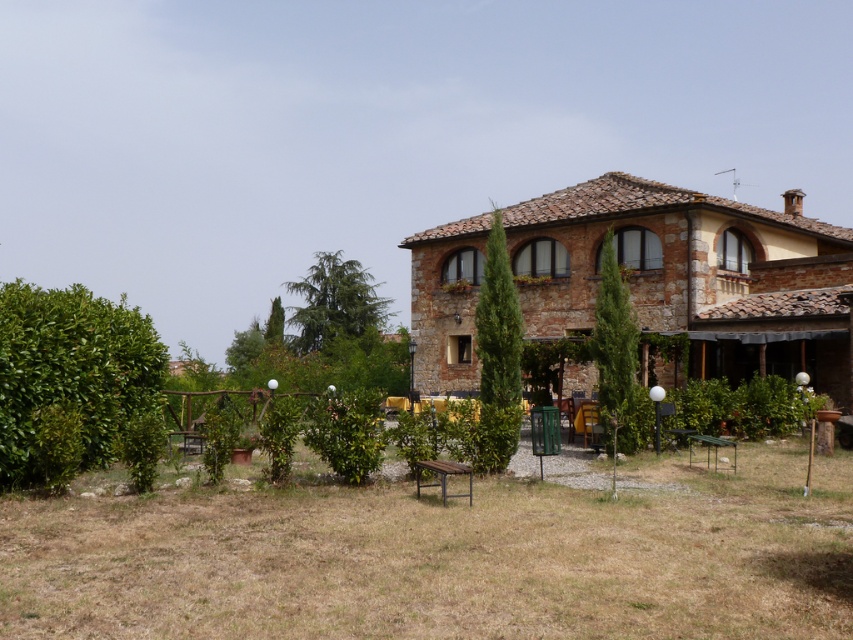
Question: Is brown wooden bench at center wider than rustic stone villa at center?

Choices:
 (A) no
 (B) yes

Answer: (A)

Question: From the image, what is the correct spatial relationship of brown wooden bench at center in relation to rustic stone villa at center?

Choices:
 (A) left
 (B) right

Answer: (A)

Question: Does brown wooden bench at center come in front of rustic stone villa at center?

Choices:
 (A) yes
 (B) no

Answer: (A)

Question: Among these objects, which one is nearest to the camera?

Choices:
 (A) rustic stone villa at center
 (B) brown wooden bench at center

Answer: (B)

Question: Among these points, which one is farthest from the camera?

Choices:
 (A) (709, 580)
 (B) (815, 230)

Answer: (B)